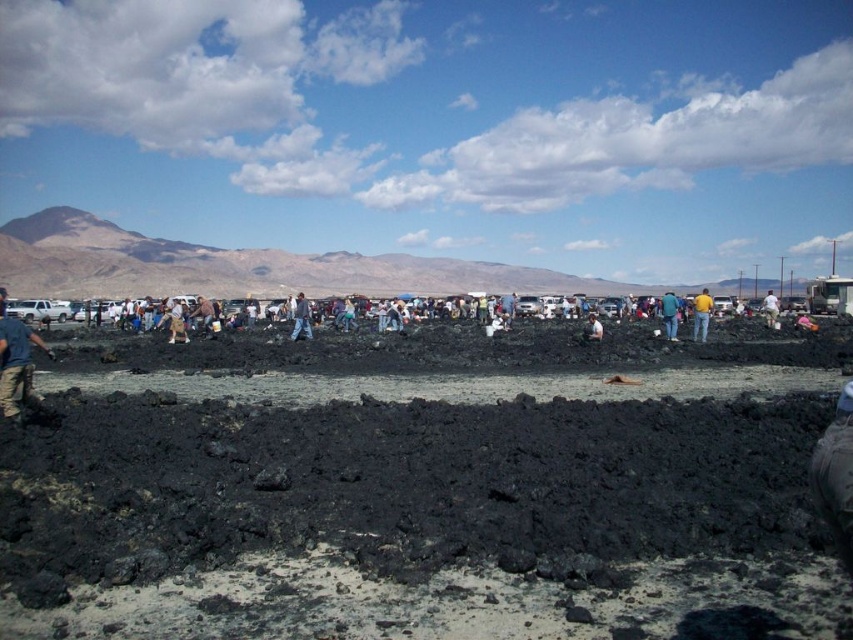
You are a photographer trying to capture a photo of both the yellow shirt at center and the light brown leather jacket at center. Which object should you focus on first to ensure both are in the frame?

The yellow shirt at center is taller than the light brown leather jacket at center, so you should focus on the yellow shirt at center first to ensure both are in the frame.

You are standing in the open area looking at the crowd. Which of the two people, the one wearing the yellow shirt at center or the light brown leather jacket at center, is closer to you?

The yellow shirt at center is closer to you because it is further to the viewer than the light brown leather jacket at center.